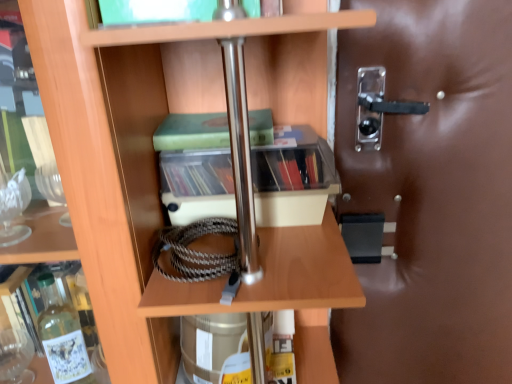
Question: Is clear plastic storage at center aimed at transparent plastic handle at right?

Choices:
 (A) yes
 (B) no

Answer: (B)

Question: Is clear plastic storage at center not inside transparent plastic handle at right?

Choices:
 (A) no
 (B) yes

Answer: (B)

Question: Does clear plastic storage at center touch transparent plastic handle at right?

Choices:
 (A) no
 (B) yes

Answer: (A)

Question: From the image's perspective, is clear plastic storage at center located above transparent plastic handle at right?

Choices:
 (A) yes
 (B) no

Answer: (A)

Question: Is clear plastic storage at center at the right side of transparent plastic handle at right?

Choices:
 (A) yes
 (B) no

Answer: (B)

Question: Looking at the image, does wooden shelf at center seem bigger or smaller compared to green matte book at center?

Choices:
 (A) small
 (B) big

Answer: (B)

Question: From the image's perspective, is wooden shelf at center positioned above or below green matte book at center?

Choices:
 (A) above
 (B) below

Answer: (B)

Question: Is wooden shelf at center inside or outside of green matte book at center?

Choices:
 (A) outside
 (B) inside

Answer: (A)

Question: Is point (325, 379) positioned closer to the camera than point (223, 117)?

Choices:
 (A) closer
 (B) farther

Answer: (B)

Question: In terms of size, does wooden shelf at center appear bigger or smaller than transparent plastic handle at right?

Choices:
 (A) big
 (B) small

Answer: (A)

Question: Is point (74, 152) closer or farther from the camera than point (422, 33)?

Choices:
 (A) farther
 (B) closer

Answer: (B)

Question: Is wooden shelf at center situated inside transparent plastic handle at right or outside?

Choices:
 (A) inside
 (B) outside

Answer: (B)

Question: In terms of width, does wooden shelf at center look wider or thinner when compared to transparent plastic handle at right?

Choices:
 (A) thin
 (B) wide

Answer: (B)

Question: Is point (204, 119) closer or farther from the camera than point (438, 21)?

Choices:
 (A) closer
 (B) farther

Answer: (A)

Question: Is green matte book at center to the left or to the right of transparent plastic handle at right in the image?

Choices:
 (A) right
 (B) left

Answer: (B)